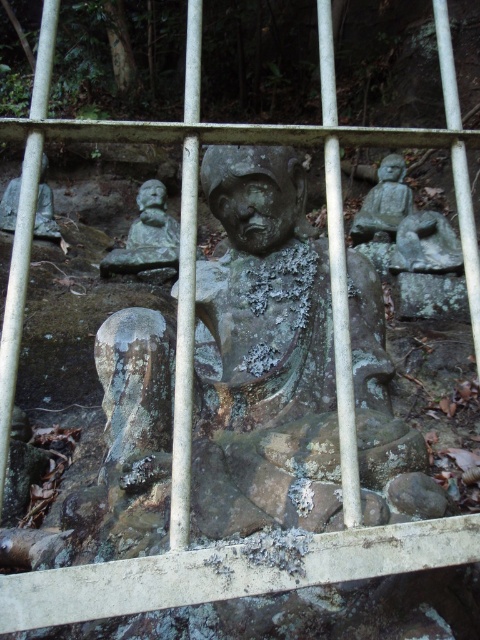
Question: Does green patina stone statue at center have a larger size compared to matte gray statue at left?

Choices:
 (A) yes
 (B) no

Answer: (A)

Question: Among these points, which one is farthest from the camera?

Choices:
 (A) (465, 284)
 (B) (268, 168)
 (C) (355, 241)

Answer: (C)

Question: Which point is farther from the camera taking this photo?

Choices:
 (A) (382, 220)
 (B) (195, 285)
 (C) (400, 305)

Answer: (A)

Question: Is green mossy rock at center thinner than smooth gray stone statue at right?

Choices:
 (A) yes
 (B) no

Answer: (A)

Question: Among these objects, which one is nearest to the camera?

Choices:
 (A) green patina stone statue at center
 (B) matte gray statue at left
 (C) smooth gray stone statue at right

Answer: (A)

Question: Can you confirm if green patina stone statue at center is positioned to the left of matte gray statue at left?

Choices:
 (A) yes
 (B) no

Answer: (B)